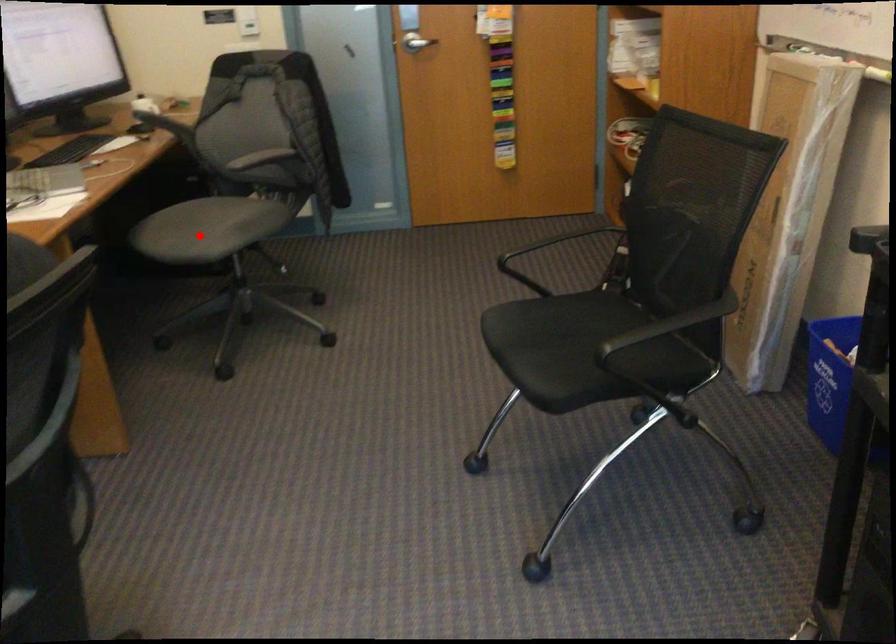
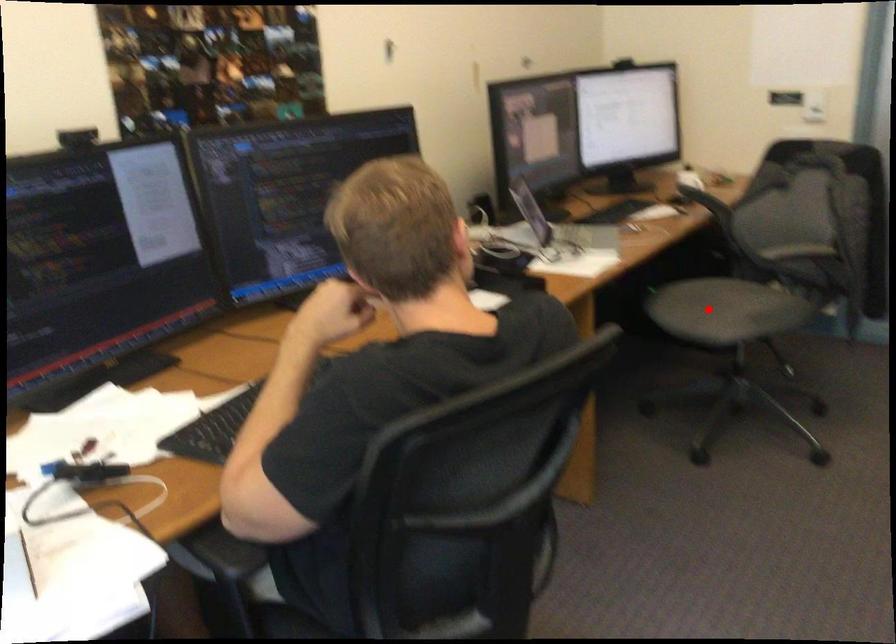
I am providing you with two images of the same scene from different viewpoints. A red point is marked on the first image and another point is marked on the second image. Are the points marked in image1 and image2 representing the same 3D position?

Yes